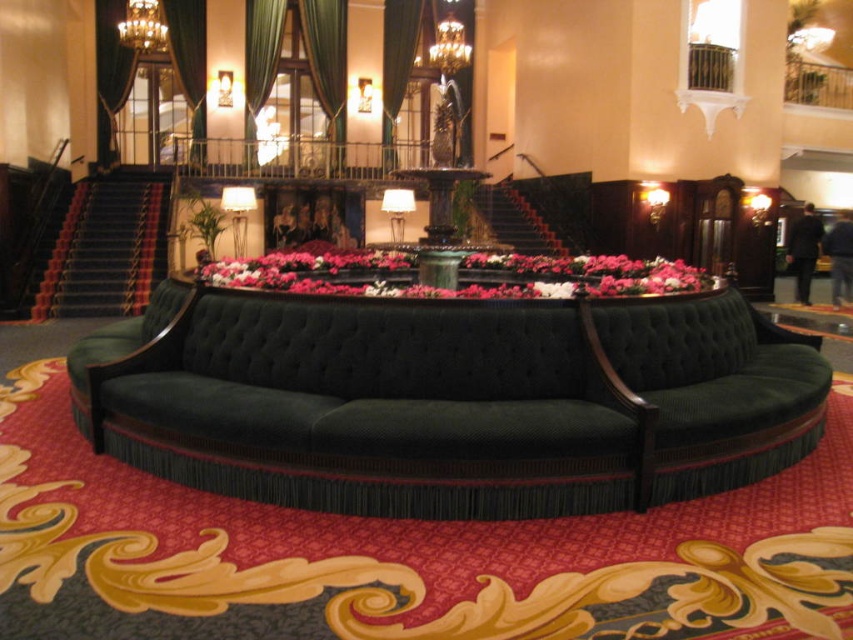
Can you confirm if velvet green couch at center is wider than dark red carpeted stairs at left?

Yes, velvet green couch at center is wider than dark red carpeted stairs at left.

Is velvet green couch at center above dark red carpeted stairs at left?

Incorrect, velvet green couch at center is not positioned above dark red carpeted stairs at left.

Identify the location of velvet green couch at center. The height and width of the screenshot is (640, 853). (450, 400).

This screenshot has height=640, width=853. I want to click on velvet green couch at center, so click(450, 400).

Is point (109, 193) in front of point (392, 13)?

Yes, it is in front of point (392, 13).

Which is in front, point (132, 244) or point (392, 163)?

Point (132, 244) is in front.

At what (x,y) coordinates should I click in order to perform the action: click on dark red carpeted stairs at left. Please return your answer as a coordinate pair (x, y). This screenshot has height=640, width=853. Looking at the image, I should click on (106, 248).

Does pink fabric flowers at center appear under green velvet curtain at upper center?

Yes.

How much distance is there between pink fabric flowers at center and green velvet curtain at upper center?

A distance of 13.76 meters exists between pink fabric flowers at center and green velvet curtain at upper center.

Is point (227, 272) positioned after point (392, 125)?

No, (227, 272) is in front of (392, 125).

The height and width of the screenshot is (640, 853). Identify the location of pink fabric flowers at center. (465, 268).